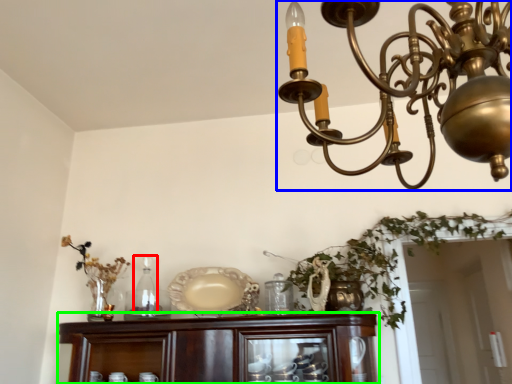
Question: Which is farther away from bottle (highlighted by a red box)? lamp (highlighted by a blue box) or cabinetry (highlighted by a green box)?

Choices:
 (A) lamp
 (B) cabinetry

Answer: (A)